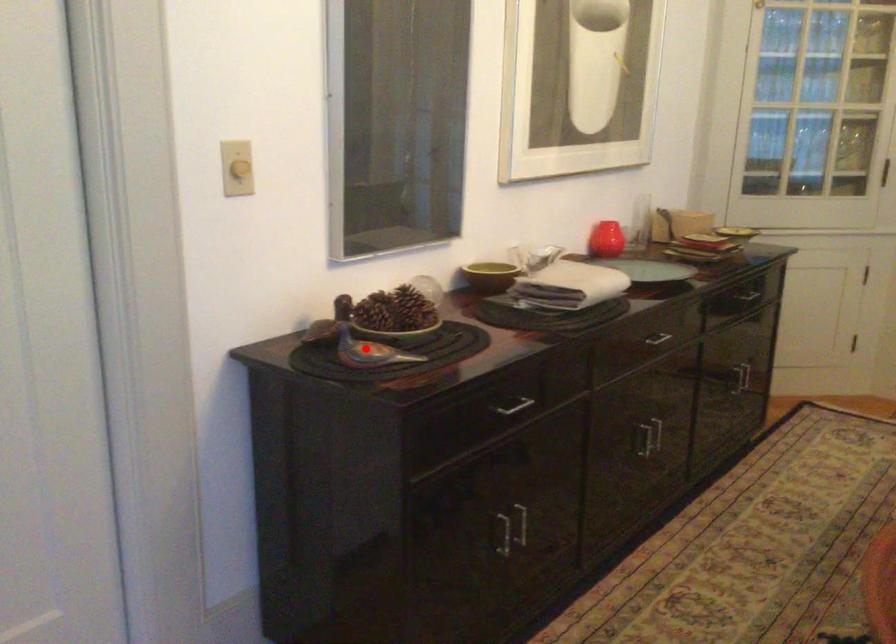
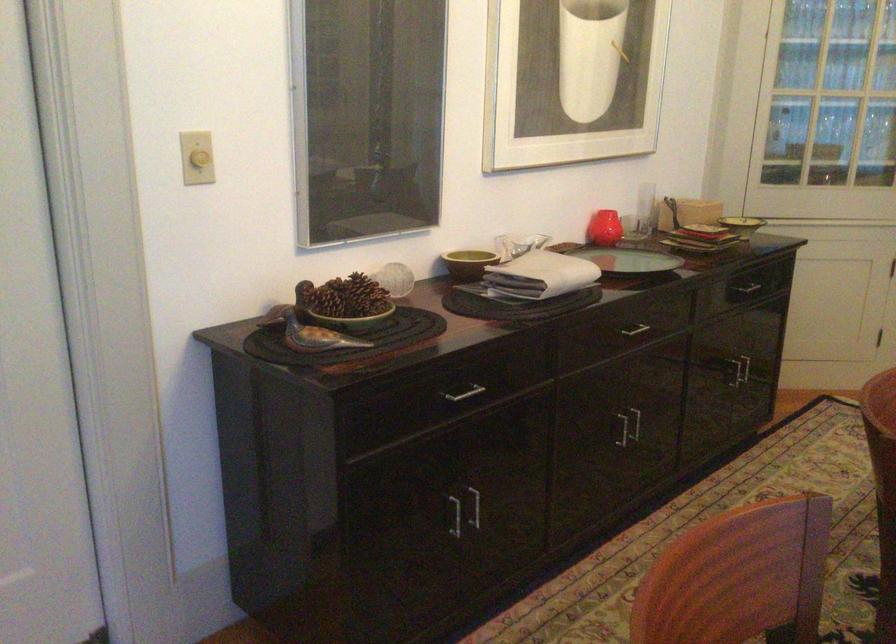
Where in the second image is the point corresponding to the highlighted location from the first image?

(312, 333)